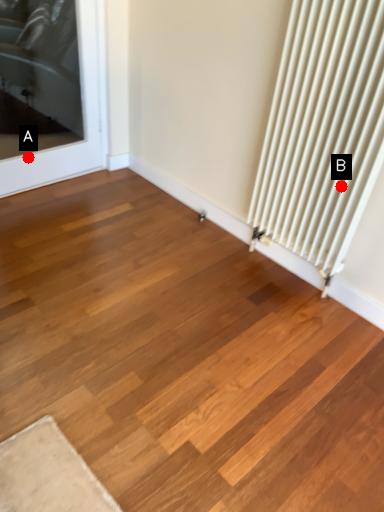
Question: Two points are circled on the image, labeled by A and B beside each circle. Which point is farther to the camera?

Choices:
 (A) A is further
 (B) B is further

Answer: (A)